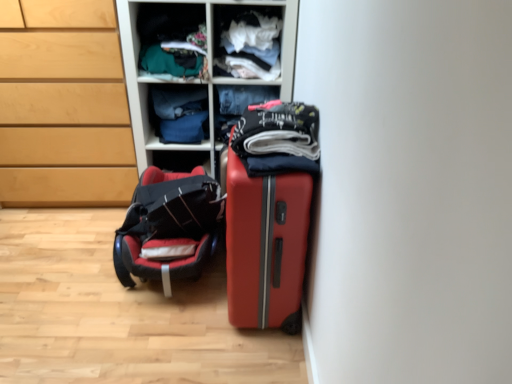
Question: From their relative heights in the image, would you say denim jeans at center, positioned as the 5th clothing in front-to-back order, is taller or shorter than dark gray cotton shirt at center, which is counted as the 1th clothing, starting from the front?

Choices:
 (A) short
 (B) tall

Answer: (B)

Question: From a real-world perspective, is denim jeans at center, marked as the 1th clothing in a back-to-front arrangement, positioned above or below dark gray cotton shirt at center, which is counted as the 1th clothing, starting from the front?

Choices:
 (A) above
 (B) below

Answer: (B)

Question: Considering the real-world distances, which object is farthest from the black leather baby car seat at lower left?

Choices:
 (A) matte plastic shelves at upper center
 (B) white cotton shirt at upper center, which is the fourth clothing in back-to-front order
 (C) denim jeans at center, positioned as the 5th clothing in front-to-back order
 (D) matte green fabric at upper center, the third clothing from the front
 (E) denim jeans at center, marked as the second clothing in a back-to-front arrangement

Answer: (B)

Question: Based on their relative distances, which object is farther from the matte wood chest of drawers at left?

Choices:
 (A) matte plastic shelves at upper center
 (B) denim jeans at center, positioned as the fourth clothing in front-to-back order
 (C) denim jeans at center, positioned as the 5th clothing in front-to-back order
 (D) white cotton shirt at upper center, which is the fourth clothing in back-to-front order
 (E) dark gray cotton shirt at center, the 5th clothing from the back

Answer: (E)